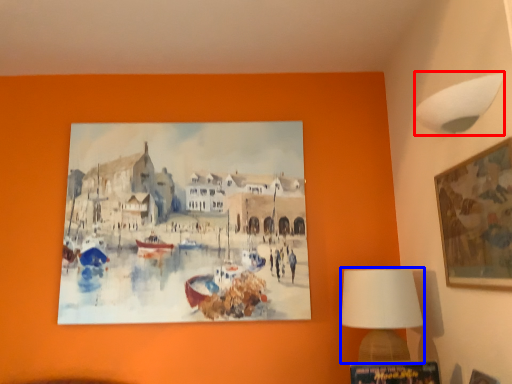
Question: Among these objects, which one is farthest to the camera, lamp (highlighted by a red box) or table lamp (highlighted by a blue box)?

Choices:
 (A) lamp
 (B) table lamp

Answer: (B)